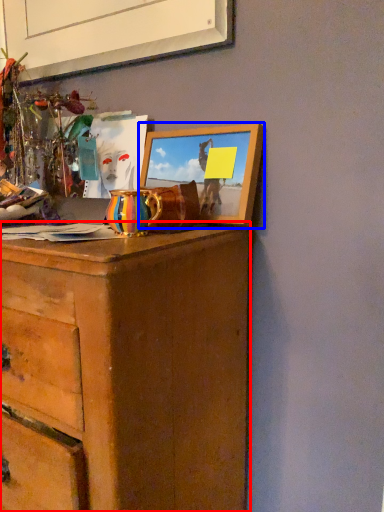
Question: Which object appears farthest to the camera in this image, chest of drawers (highlighted by a red box) or picture frame (highlighted by a blue box)?

Choices:
 (A) chest of drawers
 (B) picture frame

Answer: (B)